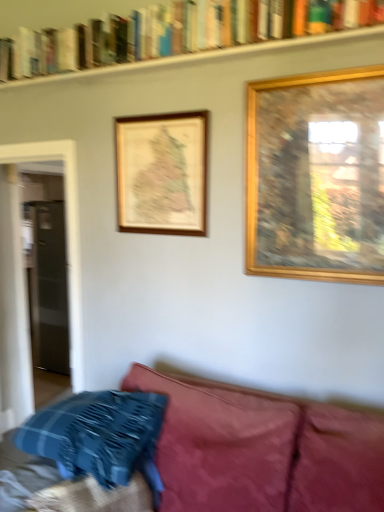
Question: In which direction should I rotate to look at wooden map at upper center, which appears as the 2th picture frame when viewed from the right?

Choices:
 (A) right
 (B) left

Answer: (B)

Question: Is blue plaid pillow at lower left facing towards hardcover books at upper center?

Choices:
 (A) yes
 (B) no

Answer: (B)

Question: Is blue plaid pillow at lower left looking in the opposite direction of hardcover books at upper center?

Choices:
 (A) no
 (B) yes

Answer: (A)

Question: Does blue plaid pillow at lower left have a lesser width compared to hardcover books at upper center?

Choices:
 (A) no
 (B) yes

Answer: (A)

Question: Does blue plaid pillow at lower left have a smaller size compared to hardcover books at upper center?

Choices:
 (A) no
 (B) yes

Answer: (A)

Question: Does blue plaid pillow at lower left have a lesser height compared to hardcover books at upper center?

Choices:
 (A) no
 (B) yes

Answer: (A)

Question: Can you confirm if blue plaid pillow at lower left is positioned to the left of hardcover books at upper center?

Choices:
 (A) no
 (B) yes

Answer: (B)

Question: Is hardcover books at upper center facing away from gold wooden picture frame at upper right, the 2th picture frame from the left?

Choices:
 (A) no
 (B) yes

Answer: (A)

Question: Can you confirm if hardcover books at upper center is taller than gold wooden picture frame at upper right, the 2th picture frame from the left?

Choices:
 (A) yes
 (B) no

Answer: (B)

Question: Is hardcover books at upper center positioned behind gold wooden picture frame at upper right, acting as the 1th picture frame starting from the front?

Choices:
 (A) no
 (B) yes

Answer: (A)

Question: Considering the relative sizes of hardcover books at upper center and gold wooden picture frame at upper right, acting as the 1th picture frame starting from the front, in the image provided, is hardcover books at upper center smaller than gold wooden picture frame at upper right, acting as the 1th picture frame starting from the front,?

Choices:
 (A) no
 (B) yes

Answer: (A)

Question: Considering the relative positions of hardcover books at upper center and gold wooden picture frame at upper right, the 2th picture frame from the left, in the image provided, is hardcover books at upper center to the right of gold wooden picture frame at upper right, the 2th picture frame from the left, from the viewer's perspective?

Choices:
 (A) no
 (B) yes

Answer: (A)

Question: Is hardcover books at upper center aimed at gold wooden picture frame at upper right, which is the 1th picture frame in right-to-left order?

Choices:
 (A) yes
 (B) no

Answer: (B)

Question: Can you confirm if wooden map at upper center, the 1th picture frame in the back-to-front sequence, is positioned to the left of clear glass door at left?

Choices:
 (A) no
 (B) yes

Answer: (A)